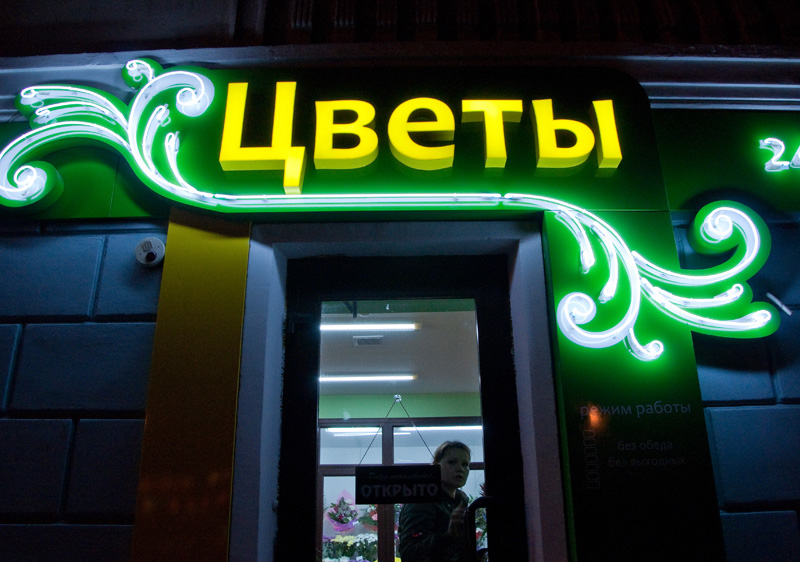
In order to click on sign on door in this screenshot , I will do `click(405, 479)`.